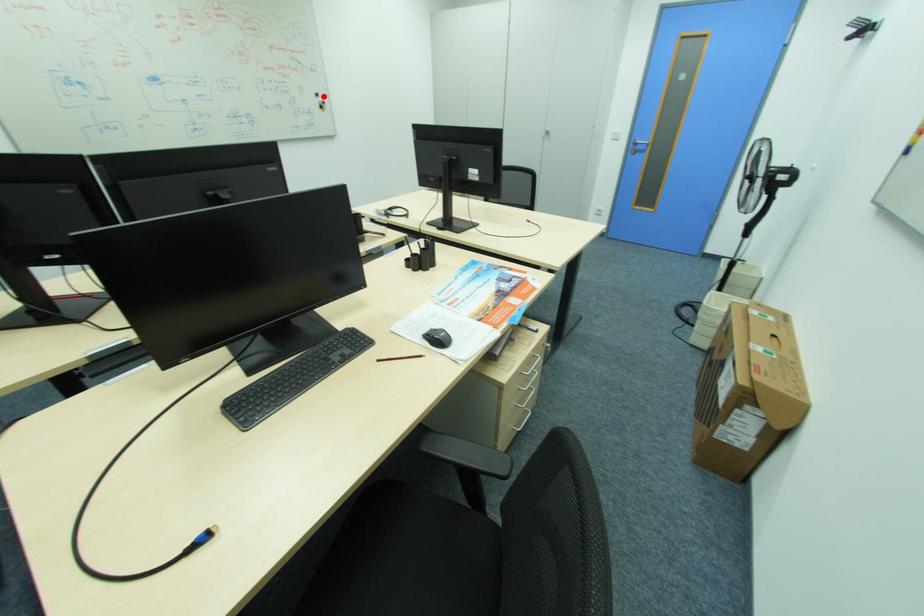
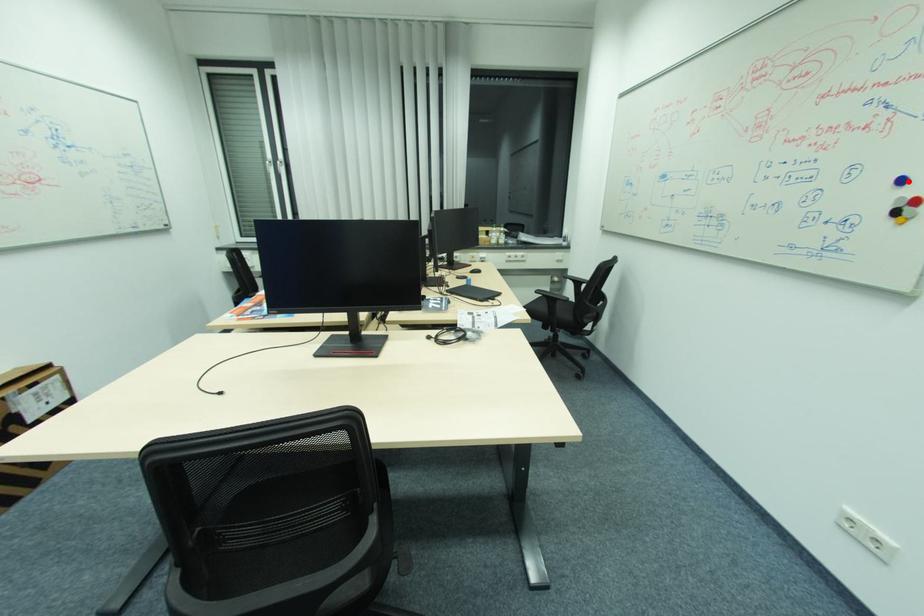
I am providing you with two images of the same scene from different viewpoints. A red point is marked on the first image and another point is marked on the second image. Do the highlighted points in image1 and image2 indicate the same real-world spot?

Yes